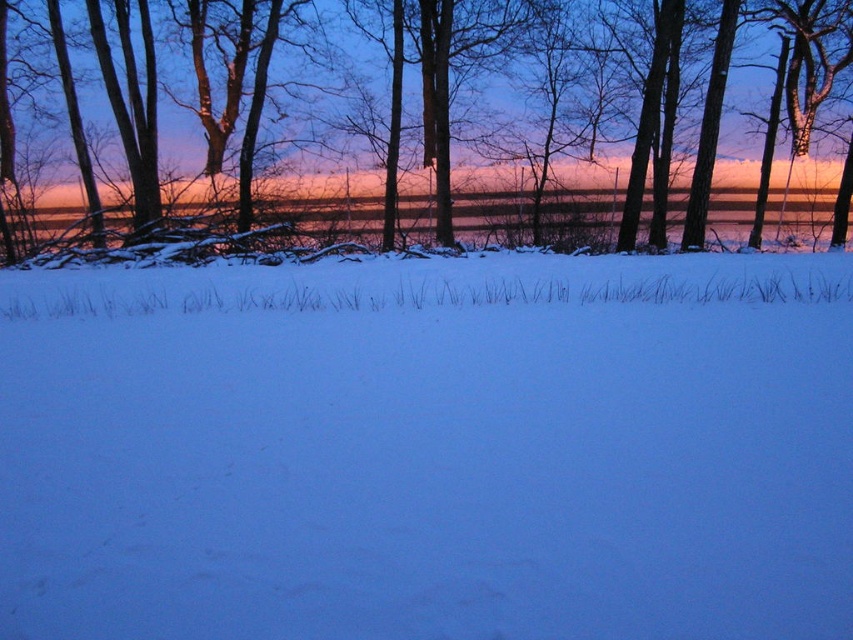
Between white powder snow at center and shiny metallic water at center, which one is positioned lower?

white powder snow at center

Can you confirm if white powder snow at center is wider than shiny metallic water at center?

Incorrect, white powder snow at center's width does not surpass shiny metallic water at center's.

Which is in front, point (527, 305) or point (372, 230)?

Positioned in front is point (527, 305).

The height and width of the screenshot is (640, 853). Find the location of `white powder snow at center`. white powder snow at center is located at coordinates (428, 449).

Which is below, white powder snow at center or smooth bark tree at upper center?

white powder snow at center is lower down.

Can you confirm if white powder snow at center is positioned to the left of smooth bark tree at upper center?

Indeed, white powder snow at center is positioned on the left side of smooth bark tree at upper center.

What do you see at coordinates (428, 449) in the screenshot? This screenshot has height=640, width=853. I see `white powder snow at center` at bounding box center [428, 449].

Where is `white powder snow at center`? The height and width of the screenshot is (640, 853). white powder snow at center is located at coordinates (428, 449).

Between point (428, 225) and point (334, 205), which one is positioned behind?

The point (428, 225) is behind.

Is smooth bark tree at upper center to the left of shiny metallic water at center from the viewer's perspective?

Incorrect, smooth bark tree at upper center is not on the left side of shiny metallic water at center.

Who is more distant from viewer, (88, 20) or (735, 221)?

The point (735, 221) is behind.

At what (x,y) coordinates should I click in order to perform the action: click on smooth bark tree at upper center. Please return your answer as a coordinate pair (x, y). This screenshot has height=640, width=853. Looking at the image, I should click on (x=456, y=122).